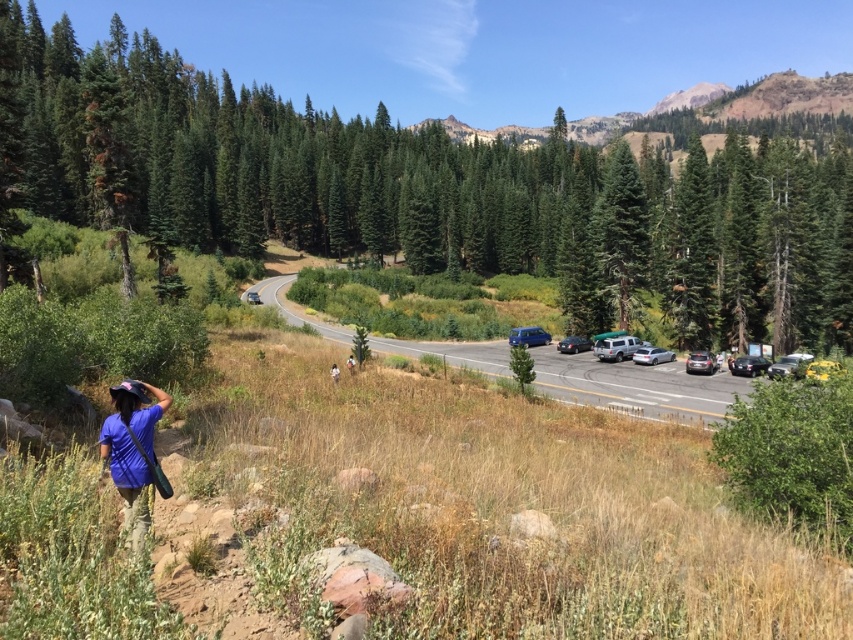
Question: Among these points, which one is nearest to the camera?

Choices:
 (A) (160, 396)
 (B) (546, 342)
 (C) (827, 81)
 (D) (683, 353)

Answer: (A)

Question: Does blue fabric bag at lower left have a larger size compared to metallic blue car at center?

Choices:
 (A) no
 (B) yes

Answer: (A)

Question: Which point is farther from the camera taking this photo?

Choices:
 (A) (664, 356)
 (B) (134, 486)
 (C) (335, 381)
 (D) (521, 337)

Answer: (D)

Question: Which of these objects is positioned farthest from the blue fabric bag at lower left?

Choices:
 (A) satin silver suv at right
 (B) metallic silver sedan at center-right
 (C) metallic asphalt highway at center

Answer: (B)

Question: Can you confirm if metallic silver car at center-right is wider than brown fabric person at lower center?

Choices:
 (A) yes
 (B) no

Answer: (A)

Question: Is the position of metallic asphalt highway at center more distant than that of blue fabric person at lower left?

Choices:
 (A) yes
 (B) no

Answer: (B)